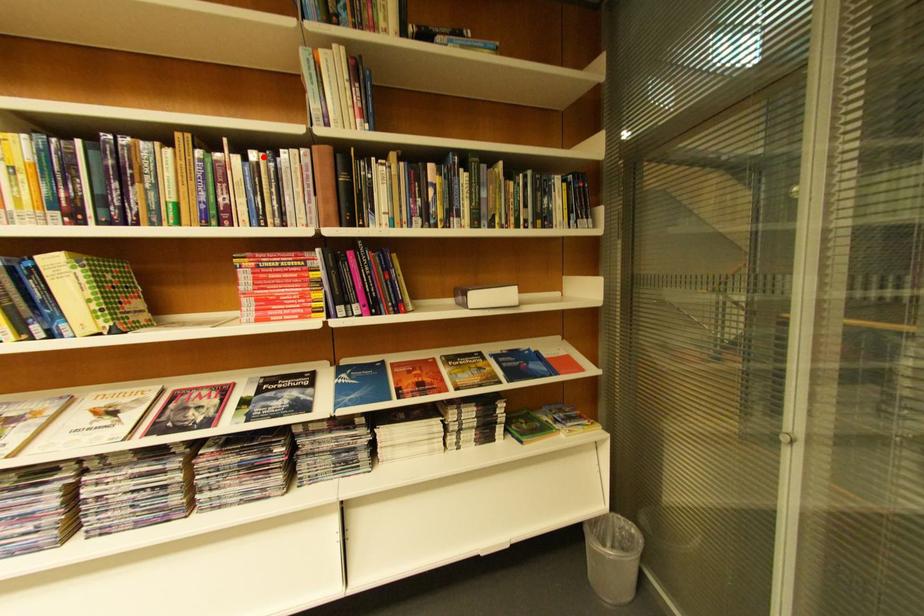
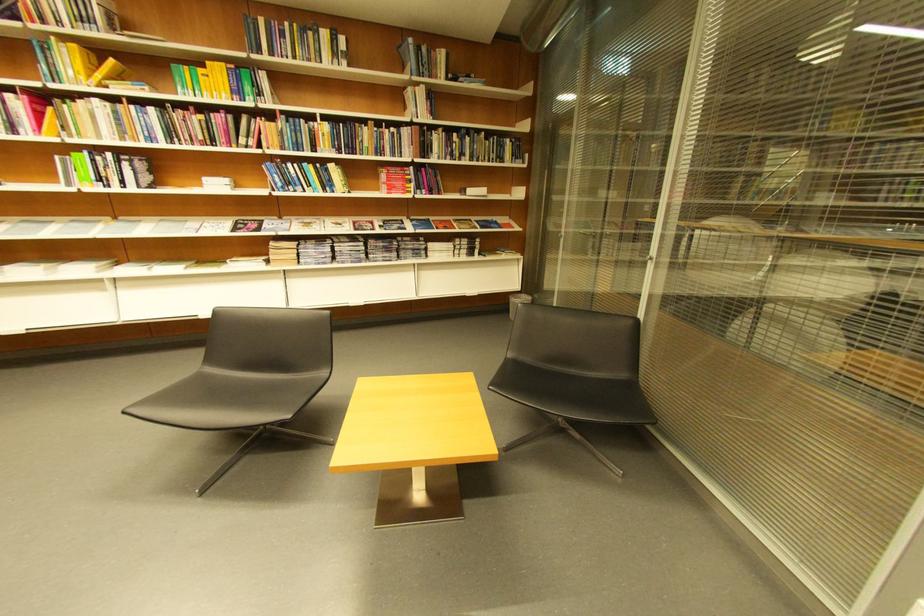
In the second image, find the point that corresponds to the highlighted location in the first image.

(403, 131)